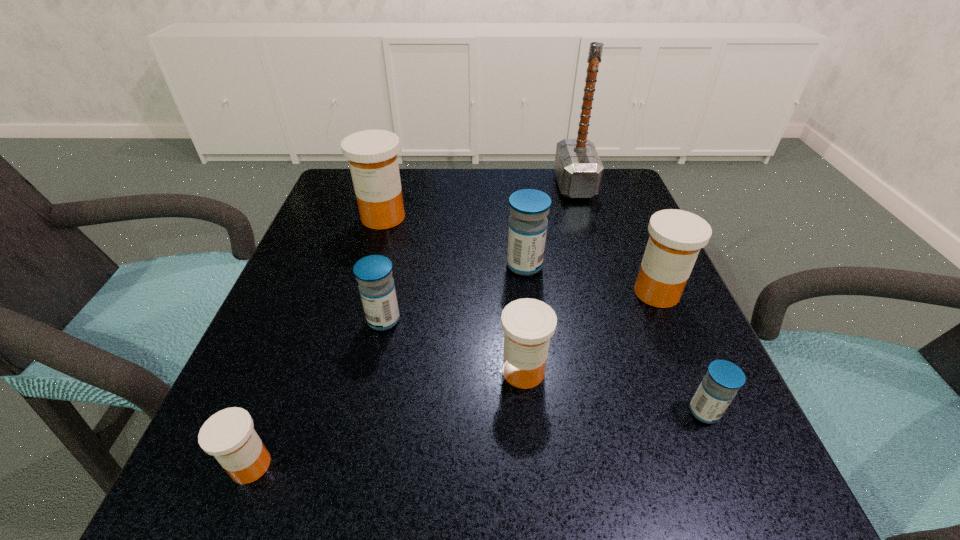
What are the coordinates of `object that stands as the closest to the leftmost blue medicine` in the screenshot? It's located at (528, 324).

At what (x,y) coordinates should I click in order to perform the action: click on medicine that is the closest to the rightmost blue medicine. Please return your answer as a coordinate pair (x, y). The image size is (960, 540). Looking at the image, I should click on (676, 236).

Select which medicine is the closest to the second farthest blue medicine. Please provide its 2D coordinates. Your answer should be formatted as a tuple, i.e. [(x, y)], where the tuple contains the x and y coordinates of a point satisfying the conditions above.

[(528, 324)]

Locate an element on the screen. Image resolution: width=960 pixels, height=540 pixels. orange medicine identified as the fourth closest to the second blue medicine from right to left is located at coordinates (228, 435).

The image size is (960, 540). Find the location of `the fourth closest orange medicine to the farthest blue medicine`. the fourth closest orange medicine to the farthest blue medicine is located at coordinates coord(228,435).

Identify which blue medicine is the second closest to the sixth farthest medicine. Please provide its 2D coordinates. Your answer should be formatted as a tuple, i.e. [(x, y)], where the tuple contains the x and y coordinates of a point satisfying the conditions above.

[(373, 273)]

Where is `the second closest blue medicine to the farthest blue medicine`? This screenshot has width=960, height=540. the second closest blue medicine to the farthest blue medicine is located at coordinates (719, 386).

Where is `free spot that satisfies the following two spatial constraints: 1. on the label of the second tallest object; 2. on the left side of the second nearest object`? Image resolution: width=960 pixels, height=540 pixels. free spot that satisfies the following two spatial constraints: 1. on the label of the second tallest object; 2. on the left side of the second nearest object is located at coordinates (327, 411).

Find the location of a particular element. This screenshot has width=960, height=540. free space that satisfies the following two spatial constraints: 1. on the back side of the second blue medicine from right to left; 2. on the right side of the leftmost blue medicine is located at coordinates (396, 266).

The width and height of the screenshot is (960, 540). Identify the location of free space in the image that satisfies the following two spatial constraints: 1. on the label of the nearest blue medicine; 2. on the right side of the second orange medicine from right to left. (527, 411).